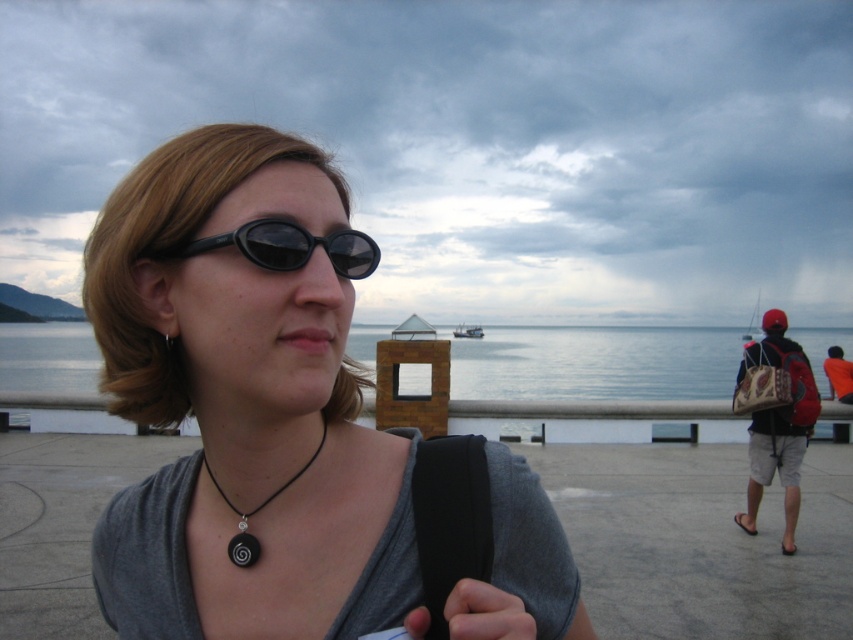
You are a photographer planning to take a portrait of the person wearing the matte gray shirt at center. The transparent water at center is reflecting the cloudy sky. How can you ensure the reflection of the sky in the water doesn

The matte gray shirt at center is positioned over transparent water at center, so positioning the camera to capture the reflection of the cloudy sky in the water beneath the matte gray shirt at center would require angling the camera to align with the water surface and the shirt.

You are a photographer trying to capture the black matte pendant at center and the transparent water at center in the same frame. Based on their positions, can you tell which object is closer to the camera?

The transparent water at center is located below the black matte pendant at center, so the black matte pendant at center is closer to the camera.

You are a photographer standing at the seaside promenade. You want to capture a photo where both the transparent water at center and the black matte pendant at center are visible. Given their relative heights, which object will appear larger in the photo?

The transparent water at center will appear larger in the photo because it has a greater height compared to the black matte pendant at center.